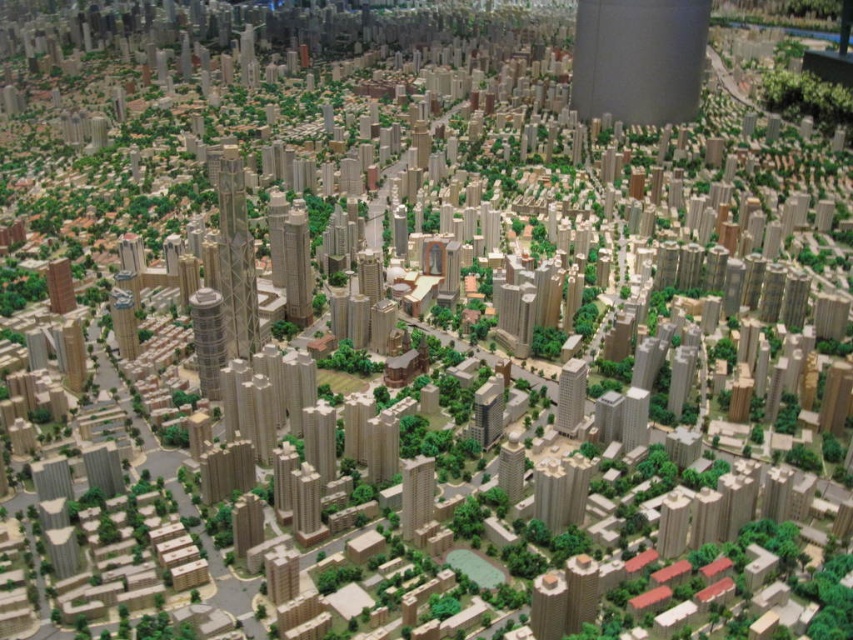
You are a drone operator tasked with capturing aerial footage of the light brown textured building at center in the futuristic city model. The drone has a maximum flight range of 1000 feet. Can the drone safely return to its starting position after filming without needing to recharge?

The light brown textured building at center is 1062.99 feet away from the viewer. Since the drone can only fly up to 1000 feet before needing to recharge, it cannot safely return to its starting position without recharging first.

You are navigating a miniature city model and need to locate the light brown textured building at center. According to the coordinates provided, where exactly is it positioned?

The light brown textured building at center is located at point (511, 467).